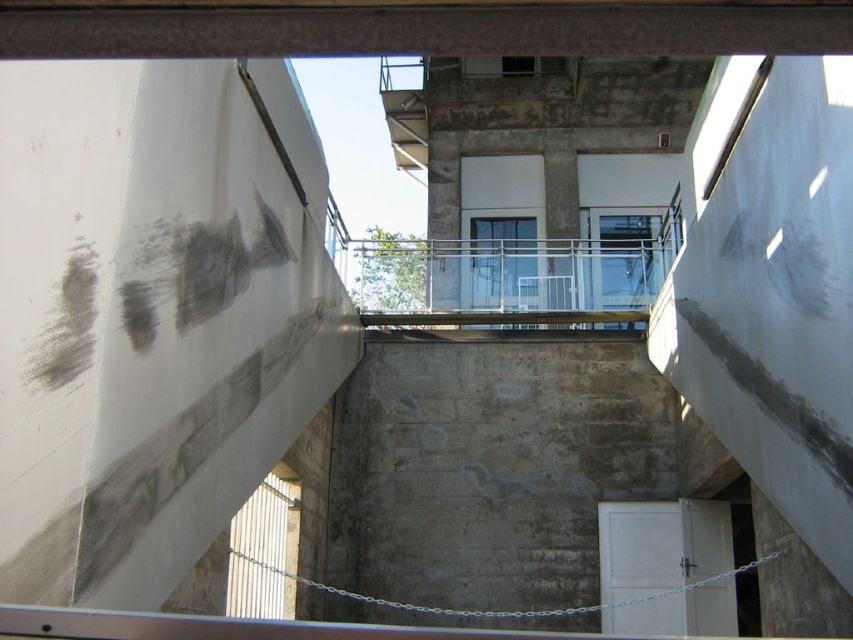
You are standing at the base of the structure and want to see the view from the clear glass balcony at center. Can you see it from your current position, considering the height of the gray concrete wall at center?

The gray concrete wall at center is much taller than the clear glass balcony at center, so the wall blocks your view of the balcony from the base.

You are standing at the base of the structure and want to look through the clear glass balcony at center. Which side of the gray concrete wall at center should you move to in order to see through it?

You should move to the right side of the gray concrete wall at center because it is positioned to the left of the clear glass balcony at center, so moving right would allow you to see around the wall.